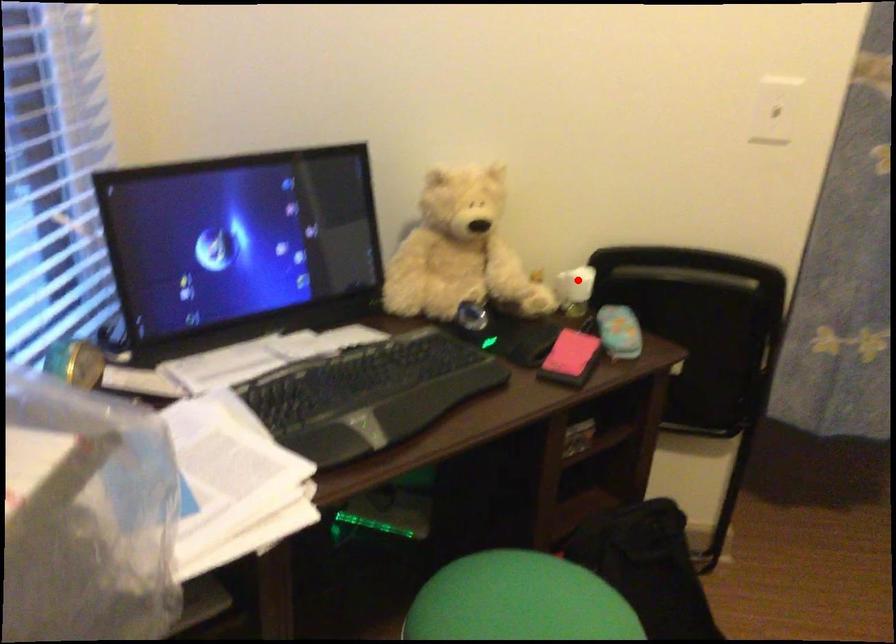
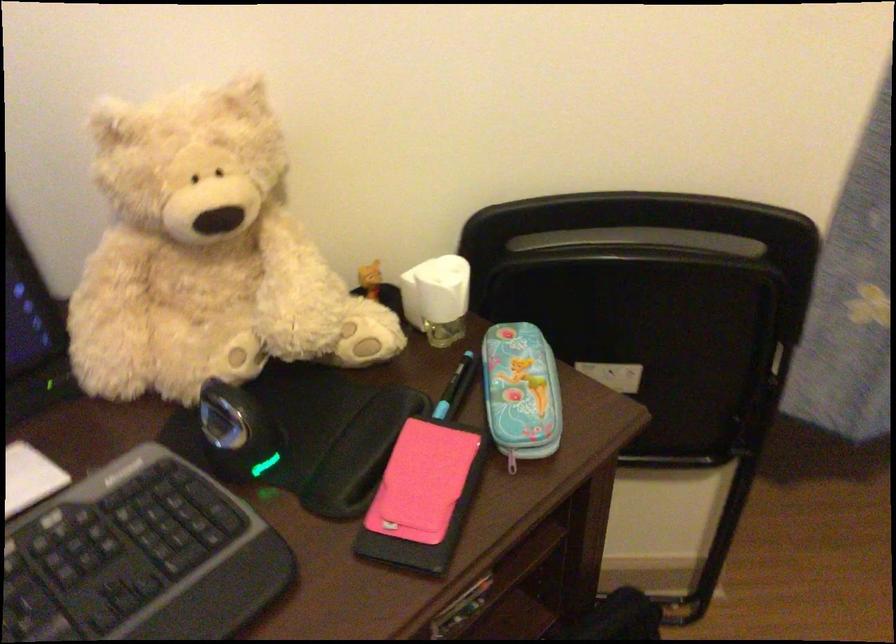
Question: I am providing you with two images of the same scene from different viewpoints. Image1 has a red point marked. In image2, the corresponding 3D location appears at what relative position? Reply with the corresponding letter.

Choices:
 (A) Closer
 (B) Farther

Answer: (A)